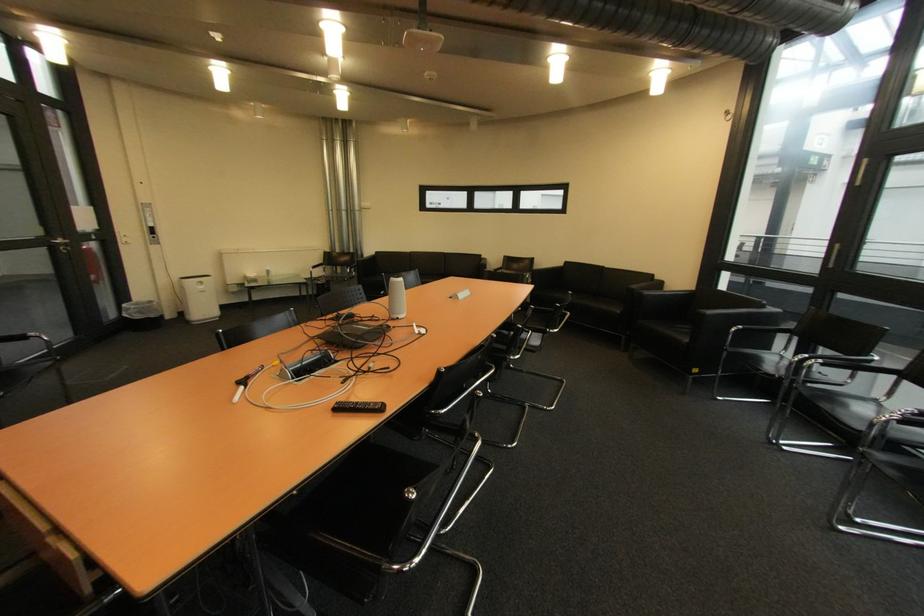
What are the coordinates of `window handle` in the screenshot? It's located at (152, 235).